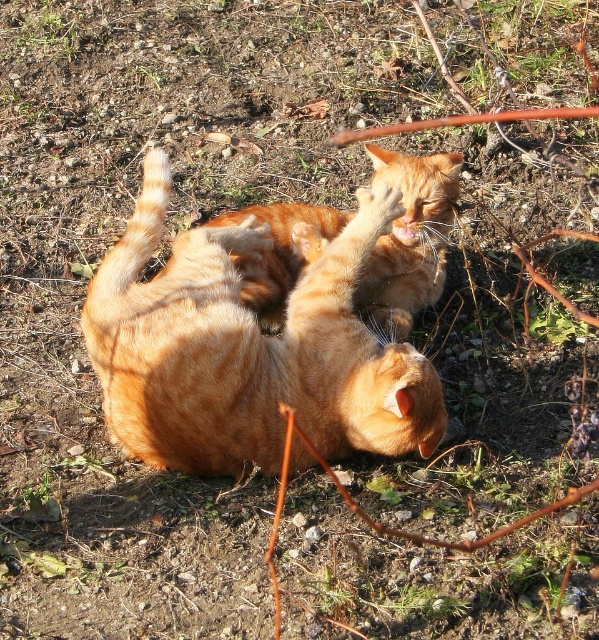
Question: Which point is closer to the camera taking this photo?

Choices:
 (A) (412, 166)
 (B) (264, 426)

Answer: (B)

Question: Is orange fur cat at center to the left of orange tabby cat at center from the viewer's perspective?

Choices:
 (A) yes
 (B) no

Answer: (A)

Question: Which point appears farthest from the camera in this image?

Choices:
 (A) (304, 320)
 (B) (415, 164)

Answer: (B)

Question: Is orange fur cat at center wider than orange tabby cat at center?

Choices:
 (A) yes
 (B) no

Answer: (A)

Question: Does orange fur cat at center have a smaller size compared to orange tabby cat at center?

Choices:
 (A) no
 (B) yes

Answer: (A)